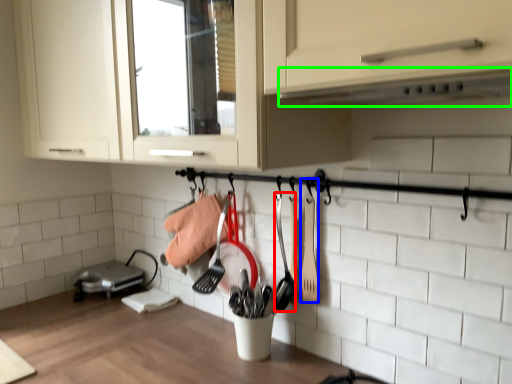
Question: Which object is the closest to the shovel (highlighted by a red box)? Choose among these: spatula (highlighted by a blue box) or exhaust hood (highlighted by a green box).

Choices:
 (A) spatula
 (B) exhaust hood

Answer: (A)